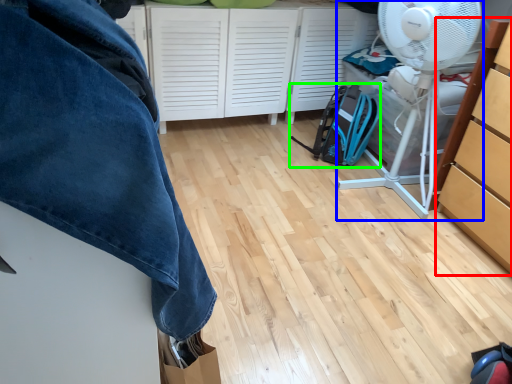
Question: Considering the real-world distances, which object is closest to cabinetry (highlighted by a red box)? mechanical fan (highlighted by a blue box) or backpack (highlighted by a green box).

Choices:
 (A) mechanical fan
 (B) backpack

Answer: (A)